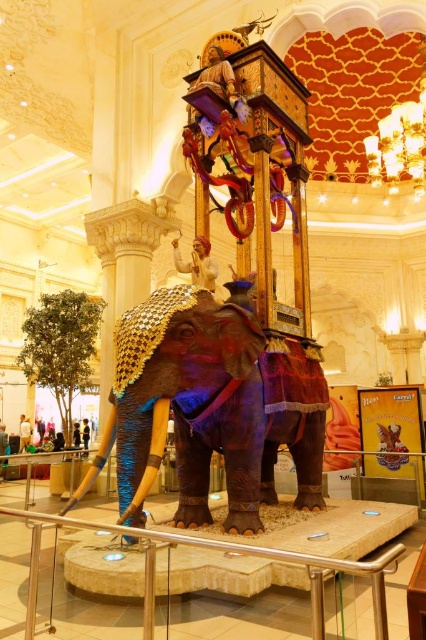
You are an architect designing a new exhibit and need to place a statue of a lion in front of the shiny purple fabric elephant at center and the satin silver railing at center. Based on their current positions, which object should the lion statue be placed to the left of?

The shiny purple fabric elephant at center is positioned on the right side of the satin silver railing at center, so the lion statue should be placed to the left of the satin silver railing at center.